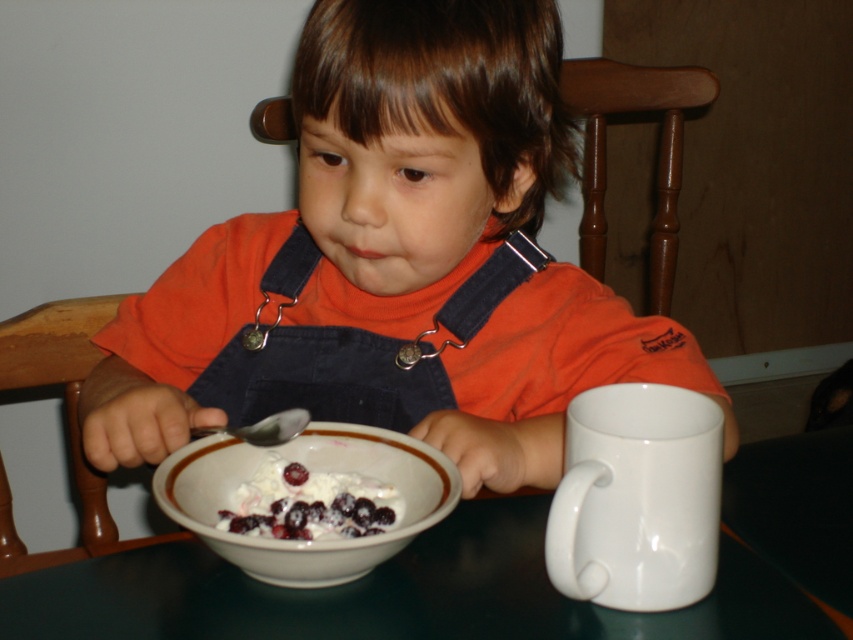
Between point (665, 264) and point (357, 513), which one is positioned behind?

Point (665, 264)

Which is behind, point (657, 200) or point (263, 534)?

Point (657, 200)

Where is `wooden chair at center`? wooden chair at center is located at coordinates (657, 156).

Who is positioned more to the left, orange cotton shirt at center or wooden chair at left?

Positioned to the left is wooden chair at left.

Who is more forward, (x=218, y=323) or (x=0, y=524)?

Point (x=218, y=323) is in front.

You are a GUI agent. You are given a task and a screenshot of the screen. Output one action in this format:
    pyautogui.click(x=<x>, y=<y>)
    Task: Click on the orange cotton shirt at center
    This screenshot has height=640, width=853.
    Given the screenshot: What is the action you would take?
    pyautogui.click(x=354, y=200)

Between point (311, 616) and point (252, 435), which one is positioned behind?

Point (252, 435)

Does point (494, 500) lie behind point (294, 433)?

Yes, it is.

Identify the location of smooth dark green table at center. (393, 593).